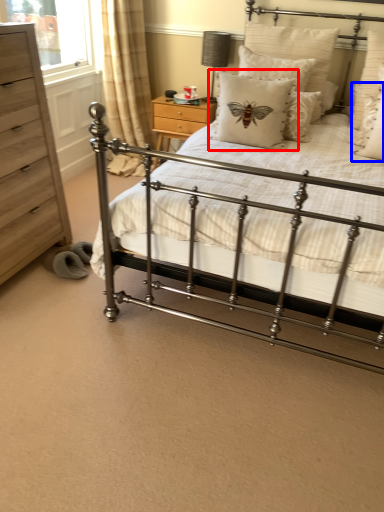
Question: Among these objects, which one is farthest to the camera, pillow (highlighted by a red box) or pillow (highlighted by a blue box)?

Choices:
 (A) pillow
 (B) pillow

Answer: (A)